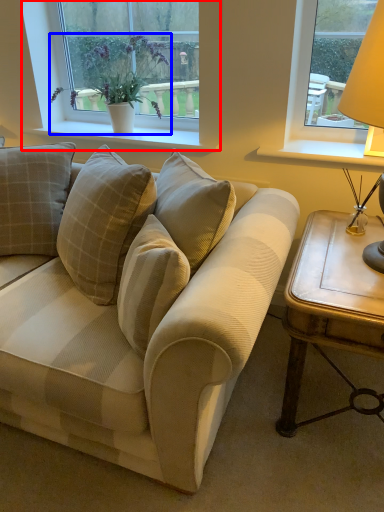
Question: Among these objects, which one is nearest to the camera, window (highlighted by a red box) or houseplant (highlighted by a blue box)?

Choices:
 (A) window
 (B) houseplant

Answer: (B)